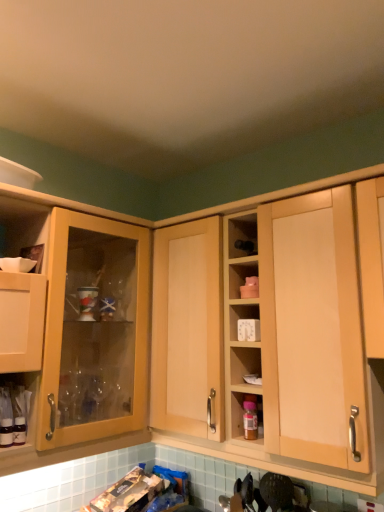
What do you see at coordinates (194, 452) in the screenshot?
I see `light wood cabinet at center, which is the first cabinetry from right to left` at bounding box center [194, 452].

The height and width of the screenshot is (512, 384). Find the location of `translucent glass bottles at lower left`. translucent glass bottles at lower left is located at coordinates (19, 409).

The height and width of the screenshot is (512, 384). Find the location of `light wood cabinet at center, which is the first cabinetry from right to left`. light wood cabinet at center, which is the first cabinetry from right to left is located at coordinates (194, 452).

Is light wood cabinet at center, which is the first cabinetry from right to left, inside or outside of translucent plastic bottle at center-right?

light wood cabinet at center, which is the first cabinetry from right to left, exists outside the volume of translucent plastic bottle at center-right.

Are light wood cabinet at center, which is the first cabinetry from right to left, and translucent plastic bottle at center-right far apart?

light wood cabinet at center, which is the first cabinetry from right to left, is near translucent plastic bottle at center-right, not far away.

Looking at this image, from the image's perspective, is light wood cabinet at center, which is the first cabinetry from right to left, below translucent plastic bottle at center-right?

No, from the image's perspective, light wood cabinet at center, which is the first cabinetry from right to left, is not beneath translucent plastic bottle at center-right.

What's the angular difference between light wood cabinet at center, which is the first cabinetry from right to left, and translucent plastic bottle at center-right's facing directions?

light wood cabinet at center, which is the first cabinetry from right to left, and translucent plastic bottle at center-right are facing 0.00566 degrees away from each other.

Considering the relative positions of light wood cabinet at center, arranged as the second cabinetry when viewed from the left, and matte wood cabinet at left, positioned as the 2th cabinetry in right-to-left order, in the image provided, is light wood cabinet at center, arranged as the second cabinetry when viewed from the left, to the right of matte wood cabinet at left, positioned as the 2th cabinetry in right-to-left order, from the viewer's perspective?

Correct, you'll find light wood cabinet at center, arranged as the second cabinetry when viewed from the left, to the right of matte wood cabinet at left, positioned as the 2th cabinetry in right-to-left order.

From a real-world perspective, is light wood cabinet at center, which is the first cabinetry from right to left, physically above matte wood cabinet at left, positioned as the first cabinetry in left-to-right order?

Indeed, from a real-world perspective, light wood cabinet at center, which is the first cabinetry from right to left, stands above matte wood cabinet at left, positioned as the first cabinetry in left-to-right order.

Is light wood cabinet at center, arranged as the second cabinetry when viewed from the left, taller than matte wood cabinet at left, positioned as the first cabinetry in left-to-right order?

No, light wood cabinet at center, arranged as the second cabinetry when viewed from the left, is not taller than matte wood cabinet at left, positioned as the first cabinetry in left-to-right order.

Considering the positions of objects matte wood cabinet at left, positioned as the first cabinetry in left-to-right order, and light wood cabinet at center, which is the first cabinetry from right to left, in the image provided, who is more to the right, matte wood cabinet at left, positioned as the first cabinetry in left-to-right order, or light wood cabinet at center, which is the first cabinetry from right to left,?

light wood cabinet at center, which is the first cabinetry from right to left, is more to the right.

Consider the image. How different are the orientations of matte wood cabinet at left, positioned as the 2th cabinetry in right-to-left order, and light wood cabinet at center, arranged as the second cabinetry when viewed from the left, in degrees?

90 degrees.

Does matte wood cabinet at left, positioned as the 2th cabinetry in right-to-left order, have a smaller size compared to light wood cabinet at center, which is the first cabinetry from right to left?

Yes, matte wood cabinet at left, positioned as the 2th cabinetry in right-to-left order, is smaller than light wood cabinet at center, which is the first cabinetry from right to left.

From a real-world perspective, which object rests below the other?

translucent glass bottles at lower left.

Can you confirm if matte wood cabinet at left, positioned as the first cabinetry in left-to-right order, is positioned to the left of translucent glass bottles at lower left?

Incorrect, matte wood cabinet at left, positioned as the first cabinetry in left-to-right order, is not on the left side of translucent glass bottles at lower left.

Based on the photo, is matte wood cabinet at left, positioned as the 2th cabinetry in right-to-left order, in front of or behind translucent glass bottles at lower left in the image?

In the image, matte wood cabinet at left, positioned as the 2th cabinetry in right-to-left order, appears in front of translucent glass bottles at lower left.

How distant is matte wood cabinet at left, positioned as the 2th cabinetry in right-to-left order, from translucent glass bottles at lower left?

matte wood cabinet at left, positioned as the 2th cabinetry in right-to-left order, is 11.89 inches from translucent glass bottles at lower left.

From the image's perspective, is light wood cabinet at center, which is the first cabinetry from right to left, located above or below translucent glass bottles at lower left?

Based on their image positions, light wood cabinet at center, which is the first cabinetry from right to left, is located above translucent glass bottles at lower left.

Between light wood cabinet at center, which is the first cabinetry from right to left, and translucent glass bottles at lower left, which one has less height?

translucent glass bottles at lower left is shorter.

Find the location of a particular element. the 2nd cabinetry to the right of the translucent glass bottles at lower left, starting your count from the anchor is located at coordinates (194, 452).

From a real-world perspective, is light wood cabinet at center, which is the first cabinetry from right to left, physically below translucent glass bottles at lower left?

Incorrect, from a real-world perspective, light wood cabinet at center, which is the first cabinetry from right to left, is higher than translucent glass bottles at lower left.

Which of these two, translucent glass bottles at lower left or light wood cabinet at center, arranged as the second cabinetry when viewed from the left, is bigger?

light wood cabinet at center, arranged as the second cabinetry when viewed from the left, is bigger.

Is translucent glass bottles at lower left far away from light wood cabinet at center, arranged as the second cabinetry when viewed from the left?

No, there isn't a large distance between translucent glass bottles at lower left and light wood cabinet at center, arranged as the second cabinetry when viewed from the left.

From a real-world perspective, is translucent glass bottles at lower left positioned under light wood cabinet at center, arranged as the second cabinetry when viewed from the left, based on gravity?

Yes, from a real-world perspective, translucent glass bottles at lower left is beneath light wood cabinet at center, arranged as the second cabinetry when viewed from the left.

From the image's perspective, is matte wood cabinet at left, positioned as the 2th cabinetry in right-to-left order, positioned above or below translucent plastic bottle at center-right?

matte wood cabinet at left, positioned as the 2th cabinetry in right-to-left order, is situated higher than translucent plastic bottle at center-right in the image.

Does matte wood cabinet at left, positioned as the first cabinetry in left-to-right order, appear on the left side of translucent plastic bottle at center-right?

Yes.

Is matte wood cabinet at left, positioned as the first cabinetry in left-to-right order, thinner than translucent plastic bottle at center-right?

In fact, matte wood cabinet at left, positioned as the first cabinetry in left-to-right order, might be wider than translucent plastic bottle at center-right.

Is matte wood cabinet at left, positioned as the first cabinetry in left-to-right order, oriented away from translucent plastic bottle at center-right?

No.

This screenshot has width=384, height=512. I want to click on bottle that appears below the light wood cabinet at center, which is the first cabinetry from right to left (from the image's perspective), so click(250, 420).

Identify the location of cabinetry located on the right of matte wood cabinet at left, positioned as the first cabinetry in left-to-right order. Image resolution: width=384 pixels, height=512 pixels. (194, 452).

Based on their spatial positions, is light wood cabinet at center, arranged as the second cabinetry when viewed from the left, or translucent glass bottles at lower left further from translucent plastic bottle at center-right?

Among the two, translucent glass bottles at lower left is located further to translucent plastic bottle at center-right.

From the image, which object appears to be nearer to matte wood cabinet at left, positioned as the first cabinetry in left-to-right order, light wood cabinet at center, arranged as the second cabinetry when viewed from the left, or translucent glass bottles at lower left?

Among the two, translucent glass bottles at lower left is located nearer to matte wood cabinet at left, positioned as the first cabinetry in left-to-right order.

Based on their spatial positions, is translucent glass bottles at lower left or matte wood cabinet at left, positioned as the first cabinetry in left-to-right order, further from light wood cabinet at center, arranged as the second cabinetry when viewed from the left?

Based on the image, matte wood cabinet at left, positioned as the first cabinetry in left-to-right order, appears to be further to light wood cabinet at center, arranged as the second cabinetry when viewed from the left.

Which object lies further to the anchor point light wood cabinet at center, which is the first cabinetry from right to left, translucent plastic bottle at center-right or translucent glass bottles at lower left?

translucent plastic bottle at center-right.

Looking at the image, which one is located further to light wood cabinet at center, which is the first cabinetry from right to left, translucent glass bottles at lower left or translucent plastic bottle at center-right?

The object further to light wood cabinet at center, which is the first cabinetry from right to left, is translucent plastic bottle at center-right.

Considering their positions, is matte wood cabinet at left, positioned as the 2th cabinetry in right-to-left order, positioned closer to light wood cabinet at center, which is the first cabinetry from right to left, than translucent glass bottles at lower left?

translucent glass bottles at lower left is positioned closer to the anchor light wood cabinet at center, which is the first cabinetry from right to left.

From the image, which object appears to be nearer to translucent plastic bottle at center-right, translucent glass bottles at lower left or light wood cabinet at center, which is the first cabinetry from right to left?

Answer: The object closer to translucent plastic bottle at center-right is light wood cabinet at center, which is the first cabinetry from right to left.

Estimate the real-world distances between objects in this image. Which object is closer to translucent plastic bottle at center-right, translucent glass bottles at lower left or matte wood cabinet at left, positioned as the first cabinetry in left-to-right order?

matte wood cabinet at left, positioned as the first cabinetry in left-to-right order, lies closer to translucent plastic bottle at center-right than the other object.

Image resolution: width=384 pixels, height=512 pixels. In order to click on cabinetry between translucent glass bottles at lower left and light wood cabinet at center, arranged as the second cabinetry when viewed from the left, in the horizontal direction in this screenshot , I will do `click(74, 331)`.

I want to click on bottle situated between translucent glass bottles at lower left and light wood cabinet at center, arranged as the second cabinetry when viewed from the left, from left to right, so click(250, 420).

Identify the location of cabinetry situated between translucent glass bottles at lower left and translucent plastic bottle at center-right from left to right. [74, 331].

I want to click on bottle situated between matte wood cabinet at left, positioned as the first cabinetry in left-to-right order, and light wood cabinet at center, arranged as the second cabinetry when viewed from the left, from left to right, so click(x=250, y=420).